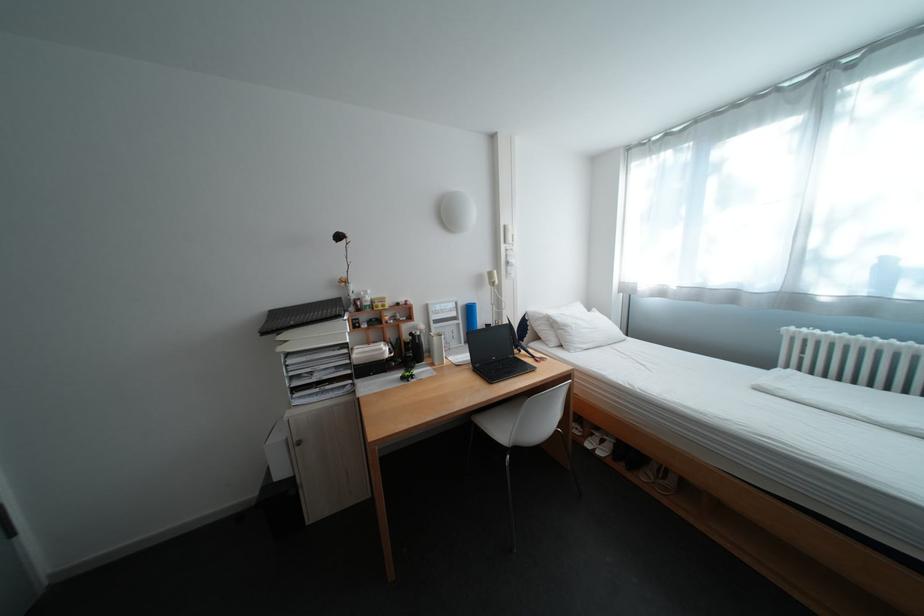
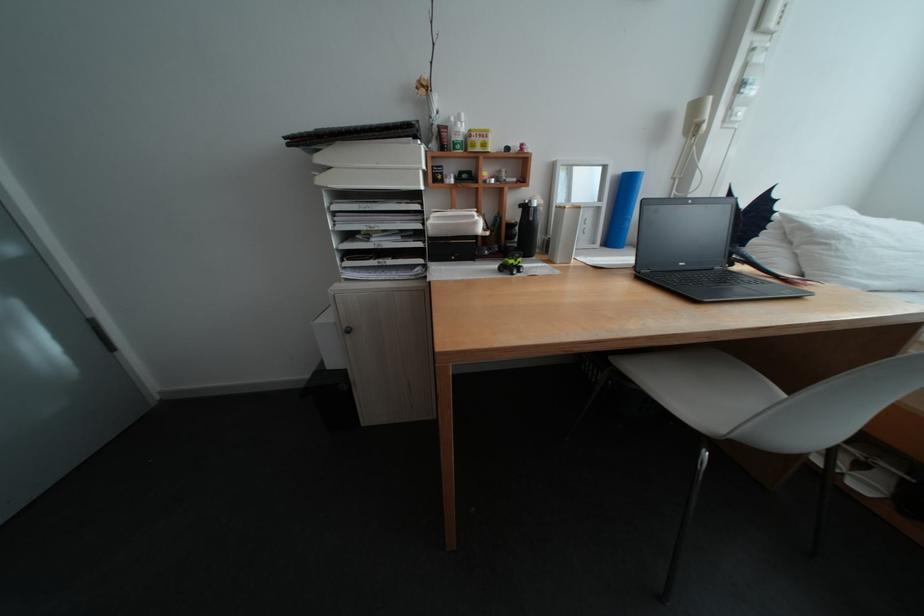
The point at (294, 339) is marked in the first image. Where is the corresponding point in the second image?

(333, 160)